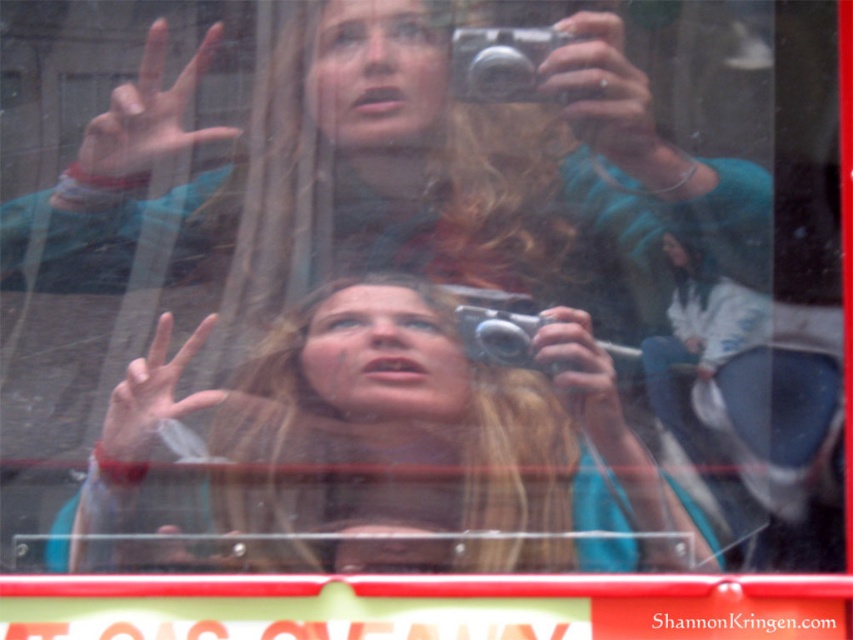
Can you confirm if matte plastic hand at center is positioned above silver metallic camera at center?

No, matte plastic hand at center is not above silver metallic camera at center.

Who is positioned more to the left, matte plastic hand at center or silver metallic camera at center?

Positioned to the left is matte plastic hand at center.

Is point (155, 339) less distant than point (515, 349)?

Yes, it is in front of point (515, 349).

The height and width of the screenshot is (640, 853). In order to click on matte plastic hand at center in this screenshot , I will do `click(151, 396)`.

Who is lower down, silver metallic camera at upper center or smooth silver camera at center?

smooth silver camera at center is lower down.

Does silver metallic camera at upper center have a lesser height compared to smooth silver camera at center?

Indeed, silver metallic camera at upper center has a lesser height compared to smooth silver camera at center.

Is point (456, 84) positioned behind point (595, 396)?

That is True.

At what (x,y) coordinates should I click in order to perform the action: click on silver metallic camera at upper center. Please return your answer as a coordinate pair (x, y). The height and width of the screenshot is (640, 853). Looking at the image, I should click on (502, 64).

Who is positioned more to the left, light skin tone hand at upper center or matte plastic hand at center?

matte plastic hand at center is more to the left.

The height and width of the screenshot is (640, 853). I want to click on light skin tone hand at upper center, so click(x=148, y=115).